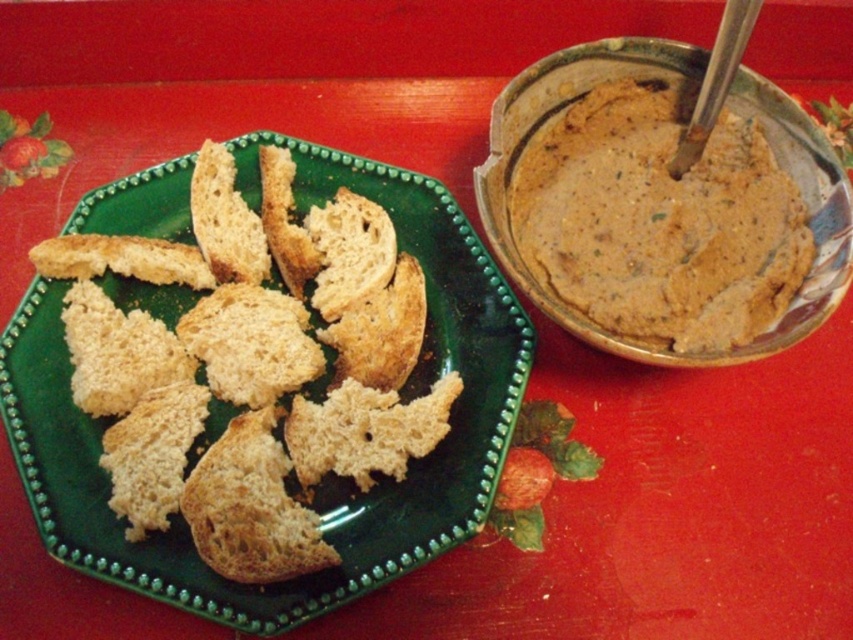
Is green matte plate at center bigger than smooth brown paste at upper right?

Yes.

Between green matte plate at center and smooth brown paste at upper right, which one has more height?

With more height is green matte plate at center.

Is point (62, 417) positioned after point (787, 273)?

No.

This screenshot has height=640, width=853. Identify the location of green matte plate at center. (x=328, y=476).

Who is more forward, [491,282] or [202,186]?

Point [491,282] is in front.

Is point (149, 204) positioned behind point (196, 198)?

Yes, it is.

Find the location of a particular element. green matte plate at center is located at coordinates (328, 476).

Between smooth brown paste at upper right and golden brown crumbly bread at center, which one appears on the right side from the viewer's perspective?

From the viewer's perspective, smooth brown paste at upper right appears more on the right side.

Between point (764, 189) and point (264, 278), which one is positioned in front?

Point (764, 189)

This screenshot has height=640, width=853. What are the coordinates of `smooth brown paste at upper right` in the screenshot? It's located at (659, 221).